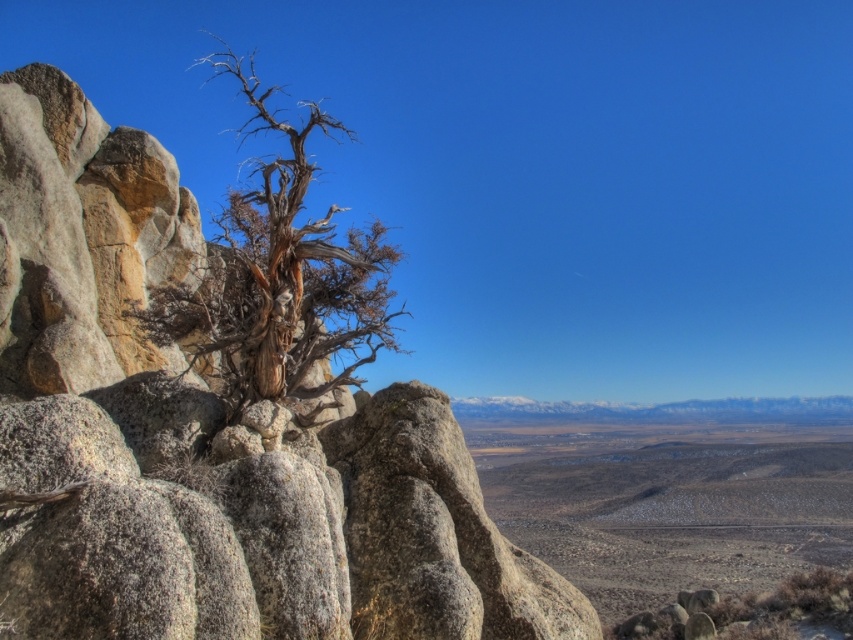
Question: Is desert soil at lower right bigger than brown/dried wood tree at left?

Choices:
 (A) no
 (B) yes

Answer: (A)

Question: From the image, what is the correct spatial relationship of desert soil at lower right in relation to brown/dried wood tree at left?

Choices:
 (A) left
 (B) right

Answer: (B)

Question: Which object is farther from the camera taking this photo?

Choices:
 (A) desert soil at lower right
 (B) brown/dried wood tree at left

Answer: (A)

Question: Can you confirm if desert soil at lower right is smaller than brown/dried wood tree at left?

Choices:
 (A) no
 (B) yes

Answer: (B)

Question: Which point is farther from the camera taking this photo?

Choices:
 (A) (607, 458)
 (B) (264, 388)

Answer: (A)